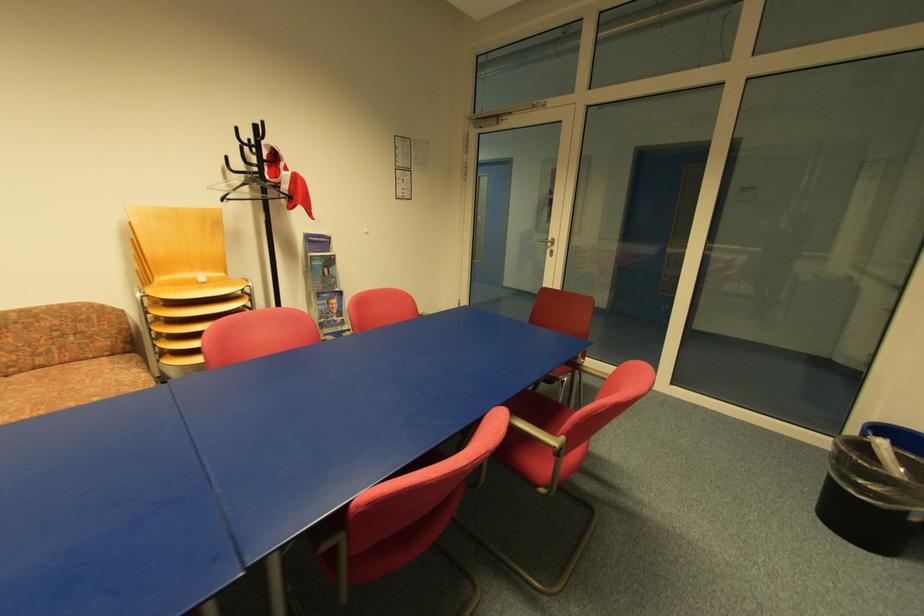
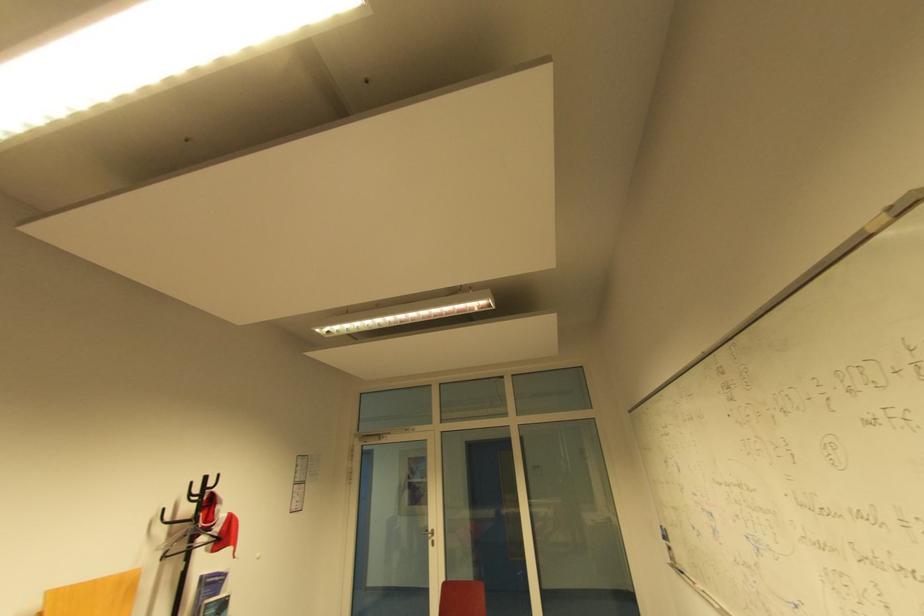
The point at (553, 240) is marked in the first image. Where is the corresponding point in the second image?

(434, 531)